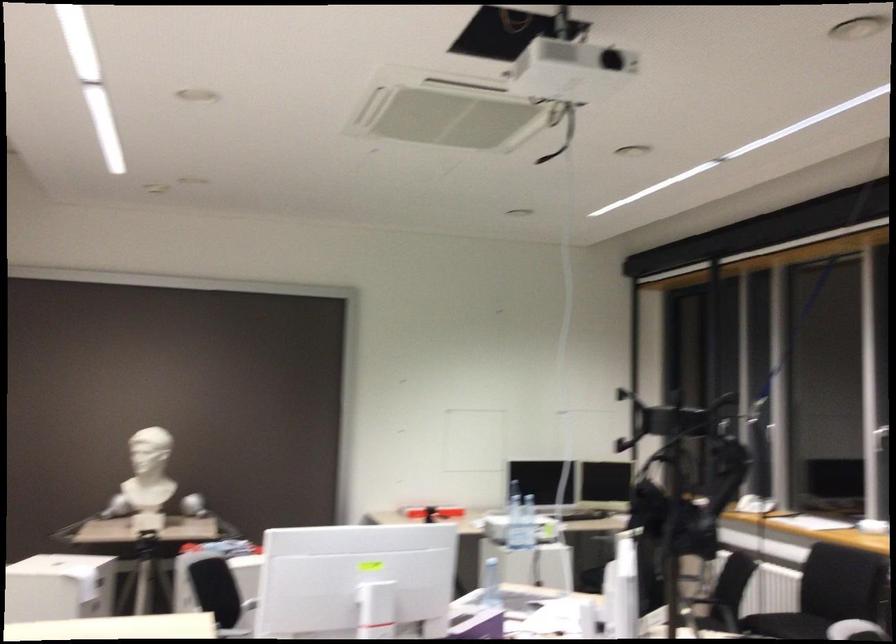
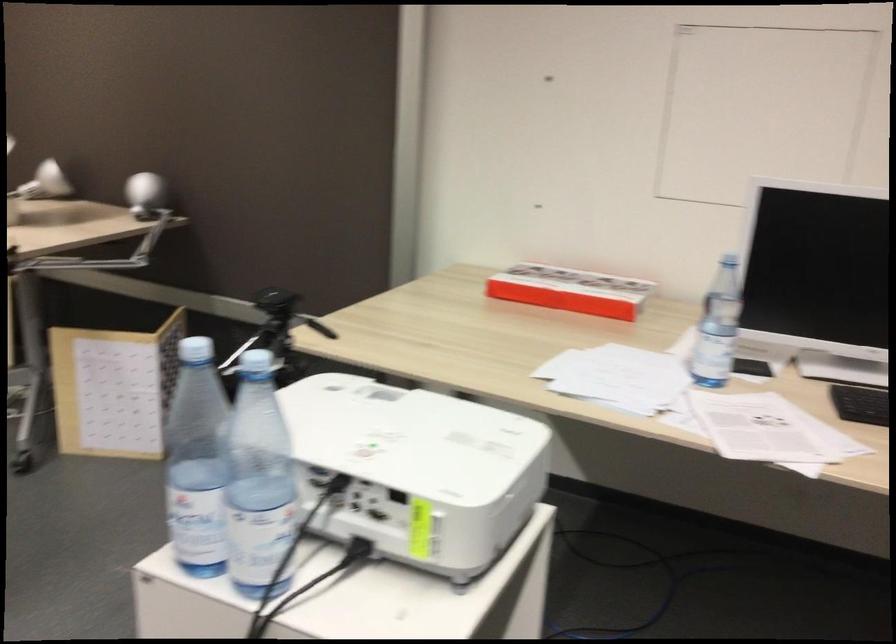
Where in the second image is the point corresponding to the point at 466,489 from the first image?

(570, 290)